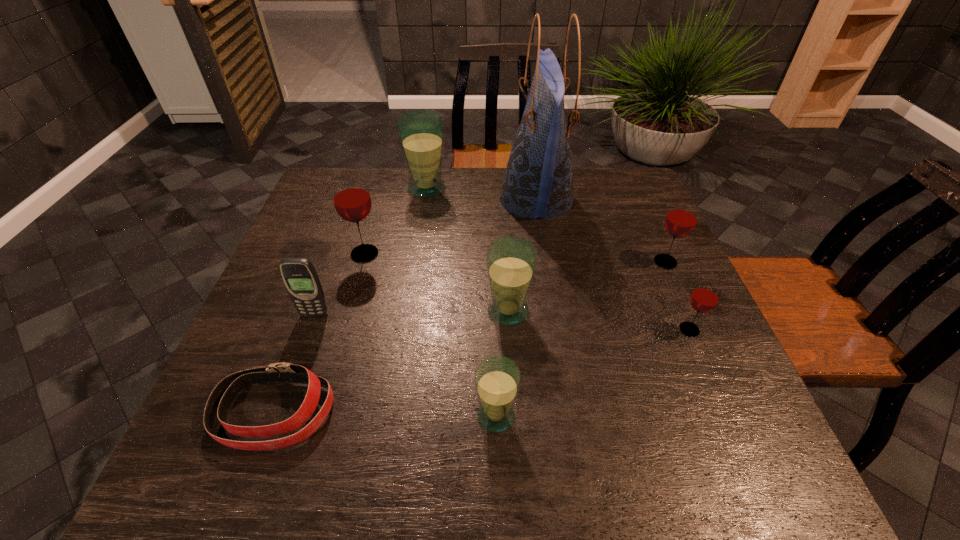
Find the location of a particular element. The width and height of the screenshot is (960, 540). free space at the near edge of the desktop is located at coordinates (557, 449).

Where is `free location at the left edge`? The image size is (960, 540). free location at the left edge is located at coordinates [327, 220].

Where is `free location at the right edge`? The width and height of the screenshot is (960, 540). free location at the right edge is located at coordinates (604, 217).

You are a GUI agent. You are given a task and a screenshot of the screen. Output one action in this format:
    pyautogui.click(x=<x>, y=<y>)
    Task: Click on the vacant space at the near left corner of the desktop
    This screenshot has width=960, height=540.
    Given the screenshot: What is the action you would take?
    pyautogui.click(x=250, y=458)

Locate an element on the screen. This screenshot has height=540, width=960. free space between the nearest blue glass and the cellular telephone is located at coordinates (405, 365).

At what (x,y) coordinates should I click in order to perform the action: click on vacant region between the dog collar and the nearest blue glass. Please return your answer as a coordinate pair (x, y). Looking at the image, I should click on (385, 414).

Identify the location of vacant region between the leftmost blue glass and the second biggest red glass. (546, 225).

Where is `vacant area that lies between the tallest object and the fifth glass from right to left`? vacant area that lies between the tallest object and the fifth glass from right to left is located at coordinates (482, 194).

Identify the location of free space between the leftmost glass and the shopping bag. (450, 227).

Identify the location of vacant space that's between the nearest red glass and the blue shopping bag. The width and height of the screenshot is (960, 540). (612, 265).